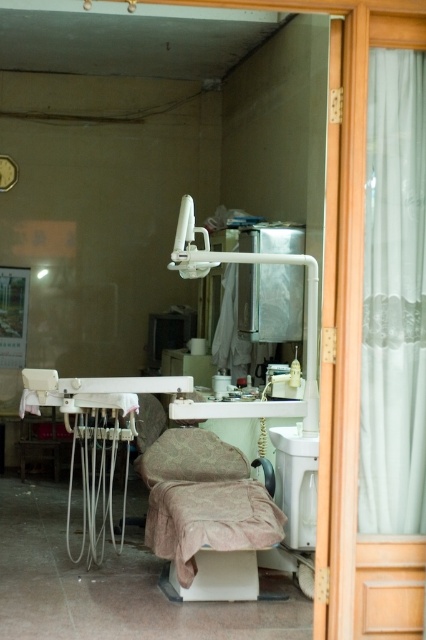
You are standing in the hallway outside the dental clinic room. You want to know where the white sheer curtain at right is located in the room. Can you tell me its position using the coordinate system provided?

The white sheer curtain at right is located at point (394,298) in the room.

You are a patient entering the dental clinic and need to wash your hands before your appointment. The white glossy sink at center is the only sink available. Is the white sheer curtain at right blocking your access to the sink?

The white sheer curtain at right is above the white glossy sink at center, so it does not block access to the sink since it is positioned higher up.